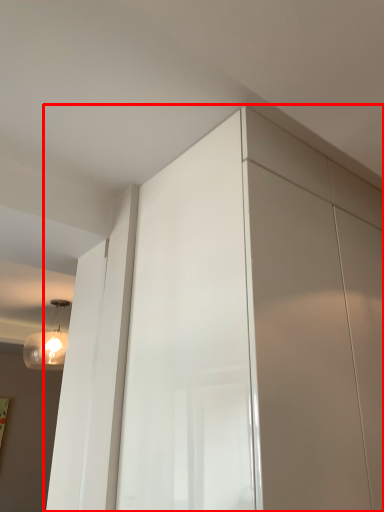
Question: From the image's perspective, considering the relative positions of dresser (annotated by the red box) and light fixture in the image provided, where is dresser (annotated by the red box) located with respect to the staircase?

Choices:
 (A) below
 (B) above

Answer: (B)